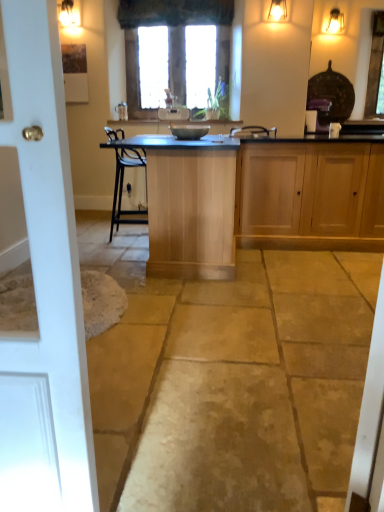
Question: From a real-world perspective, is light wood cabinet at right positioned above or below natural stone floor at center?

Choices:
 (A) above
 (B) below

Answer: (A)

Question: Choose the correct answer: Is light wood cabinet at right inside natural stone floor at center or outside it?

Choices:
 (A) outside
 (B) inside

Answer: (A)

Question: Which object is the closest to the matte gold light fixture at upper right?

Choices:
 (A) light wood cabinet at right
 (B) matte black appliance at center
 (C) matte silver faucet at center
 (D) white wood door at left
 (E) clear glass windows at center

Answer: (E)

Question: Considering the real-world distances, which object is closest to the matte silver faucet at center?

Choices:
 (A) natural stone floor at center
 (B) clear glass windows at center
 (C) matte black appliance at center
 (D) white wood door at left
 (E) matte gold light fixture at upper right

Answer: (B)